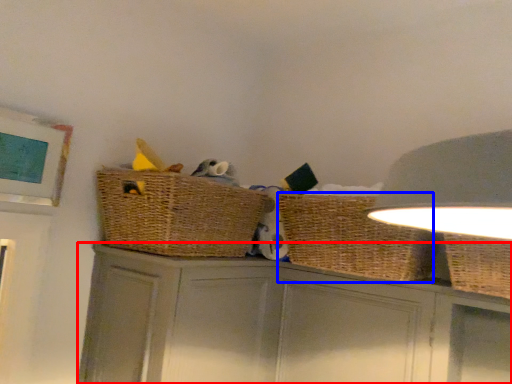
Question: Which of the following is the farthest to the observer, cabinetry (highlighted by a red box) or basket (highlighted by a blue box)?

Choices:
 (A) cabinetry
 (B) basket

Answer: (B)